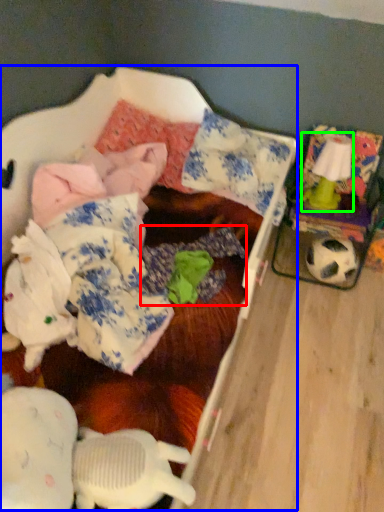
Question: Estimate the real-world distances between objects in this image. Which object is farther from clothing (highlighted by a red box), bed (highlighted by a blue box) or toy (highlighted by a green box)?

Choices:
 (A) bed
 (B) toy

Answer: (B)